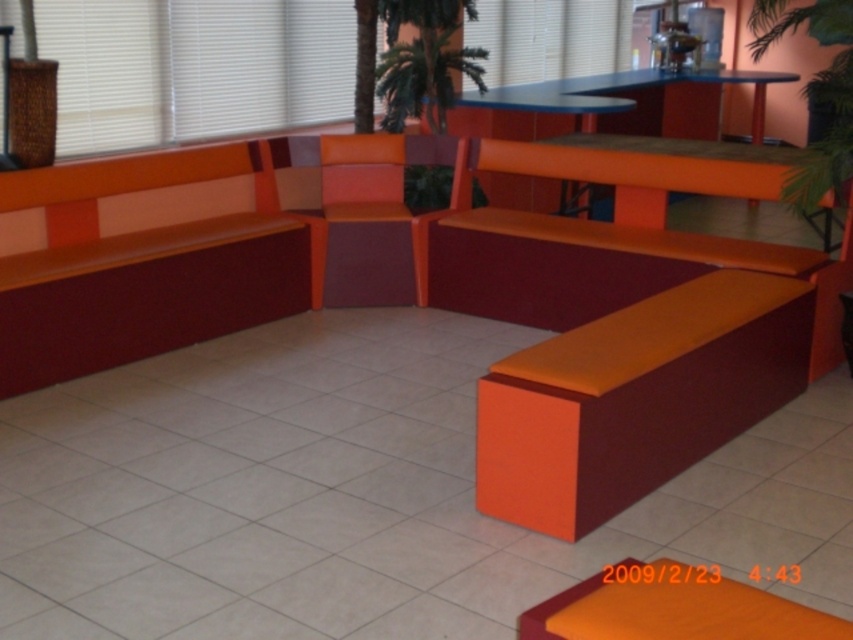
You are planning to place a 1.5 meter wide rug in this seating area. The orange matte bench at lower right and the orange matte bench at left are both in your way. Which bench needs to be moved first to accommodate the rug?

The orange matte bench at lower right needs to be moved first because it has a greater width than the orange matte bench at left, so moving it first would free up more space for the rug.

You are a delivery person trying to place a large package that requires 18 feet of space between two orange items. Can you fit it between the orange matte table at upper center and the orange matte stool at lower right?

The orange matte table at upper center and orange matte stool at lower right are 17.29 feet apart, which is less than the required 18 feet. Therefore, the package cannot be placed between them.